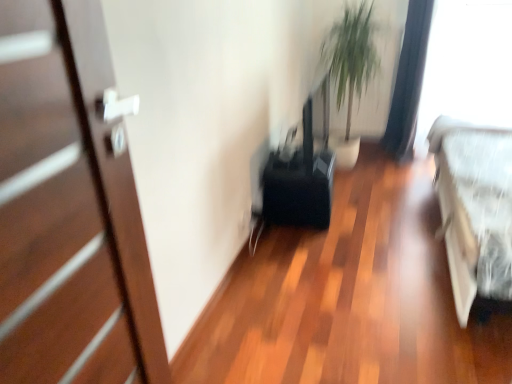
Where is `white fabric bed at right`? white fabric bed at right is located at coordinates (475, 209).

Image resolution: width=512 pixels, height=384 pixels. What do you see at coordinates (408, 81) in the screenshot? I see `black fabric curtain at upper right` at bounding box center [408, 81].

You are a GUI agent. You are given a task and a screenshot of the screen. Output one action in this format:
    pyautogui.click(x=<x>, y=<y>)
    Task: Click on the white fabric bed at right
    
    Given the screenshot: What is the action you would take?
    pyautogui.click(x=475, y=209)

Which point is more distant from viewer, (347, 67) or (418, 95)?

The point (418, 95) is more distant.

Considering the sizes of objects green leafy plant at upper center and black fabric curtain at upper right in the image provided, who is wider, green leafy plant at upper center or black fabric curtain at upper right?

With larger width is black fabric curtain at upper right.

Which object is closer to the camera, green leafy plant at upper center or black fabric curtain at upper right?

Positioned in front is black fabric curtain at upper right.

Between transparent plastic window screen at upper right and white fabric bed at right, which one appears on the left side from the viewer's perspective?

white fabric bed at right is more to the left.

How much distance is there between transparent plastic window screen at upper right and white fabric bed at right?

transparent plastic window screen at upper right and white fabric bed at right are 39.33 inches apart from each other.

Is transparent plastic window screen at upper right wider than white fabric bed at right?

In fact, transparent plastic window screen at upper right might be narrower than white fabric bed at right.

Where is `bed in front of the transparent plastic window screen at upper right`? The width and height of the screenshot is (512, 384). bed in front of the transparent plastic window screen at upper right is located at coordinates (475, 209).

In order to click on door on the left of the transparent plastic window screen at upper right in this screenshot , I will do `click(69, 210)`.

In the scene shown: Considering the relative sizes of matte white door at left and transparent plastic window screen at upper right in the image provided, is matte white door at left shorter than transparent plastic window screen at upper right?

Yes.

Is transparent plastic window screen at upper right located within matte white door at left?

No, transparent plastic window screen at upper right is not surrounded by matte white door at left.

From a real-world perspective, who is located higher, matte white door at left or transparent plastic window screen at upper right?

matte white door at left, from a real-world perspective.

Which of these two, green leafy plant at upper center or white fabric bed at right, stands taller?

With more height is green leafy plant at upper center.

From the image's perspective, does green leafy plant at upper center appear higher than white fabric bed at right?

Yes, from the image's perspective, green leafy plant at upper center is above white fabric bed at right.

Is green leafy plant at upper center in contact with white fabric bed at right?

There is a gap between green leafy plant at upper center and white fabric bed at right.

Can you confirm if green leafy plant at upper center is positioned to the left of white fabric bed at right?

Indeed, green leafy plant at upper center is positioned on the left side of white fabric bed at right.

Is matte white door at left not within green leafy plant at upper center?

Yes.

Is matte white door at left thinner than green leafy plant at upper center?

In fact, matte white door at left might be wider than green leafy plant at upper center.

In the scene shown: Is matte white door at left positioned behind green leafy plant at upper center?

No, it is not.

Does white fabric bed at right have a greater width compared to green leafy plant at upper center?

Yes.

Considering the relative sizes of white fabric bed at right and green leafy plant at upper center in the image provided, is white fabric bed at right shorter than green leafy plant at upper center?

Indeed, white fabric bed at right has a lesser height compared to green leafy plant at upper center.

From the image's perspective, between white fabric bed at right and green leafy plant at upper center, who is located below?

white fabric bed at right is shown below in the image.

From a real-world perspective, does white fabric bed at right stand above green leafy plant at upper center?

No, from a real-world perspective, white fabric bed at right is not above green leafy plant at upper center.

Is black fabric curtain at upper right looking in the opposite direction of transparent plastic window screen at upper right?

That's not correct — black fabric curtain at upper right is not looking away from transparent plastic window screen at upper right.

From their relative heights in the image, would you say black fabric curtain at upper right is taller or shorter than transparent plastic window screen at upper right?

In the image, black fabric curtain at upper right appears to be taller than transparent plastic window screen at upper right.

Locate an element on the screen. This screenshot has height=384, width=512. curtain above the transparent plastic window screen at upper right (from the image's perspective) is located at coordinates (408, 81).

From a real-world perspective, is black fabric curtain at upper right located beneath transparent plastic window screen at upper right?

No, from a real-world perspective, black fabric curtain at upper right is not under transparent plastic window screen at upper right.

Identify the location of plant that appears behind the black fabric curtain at upper right. (357, 70).

Locate an element on the screen. bed on the left of transparent plastic window screen at upper right is located at coordinates (475, 209).

Which object lies nearer to the anchor point matte white door at left, transparent plastic window screen at upper right or black fabric curtain at upper right?

black fabric curtain at upper right lies closer to matte white door at left than the other object.

When comparing their distances from transparent plastic window screen at upper right, does green leafy plant at upper center or matte white door at left seem further?

Based on the image, matte white door at left appears to be further to transparent plastic window screen at upper right.

From the picture: When comparing their distances from black fabric curtain at upper right, does transparent plastic window screen at upper right or matte white door at left seem further?

matte white door at left is positioned further to the anchor black fabric curtain at upper right.

Looking at the image, which one is located closer to transparent plastic window screen at upper right, black fabric curtain at upper right or white fabric bed at right?

black fabric curtain at upper right.

From the image, which object appears to be nearer to green leafy plant at upper center, black fabric curtain at upper right or white fabric bed at right?

black fabric curtain at upper right lies closer to green leafy plant at upper center than the other object.

Looking at this image, looking at the image, which one is located closer to white fabric bed at right, transparent plastic window screen at upper right or matte white door at left?

Based on the image, transparent plastic window screen at upper right appears to be nearer to white fabric bed at right.

Considering their positions, is white fabric bed at right positioned further to black fabric curtain at upper right than transparent plastic window screen at upper right?

Among the two, white fabric bed at right is located further to black fabric curtain at upper right.

Looking at the image, which one is located closer to matte white door at left, black fabric curtain at upper right or green leafy plant at upper center?

green leafy plant at upper center is closer to matte white door at left.

Where is `bed between matte white door at left and green leafy plant at upper center in the front-back direction`? Image resolution: width=512 pixels, height=384 pixels. bed between matte white door at left and green leafy plant at upper center in the front-back direction is located at coordinates (475, 209).

At what (x,y) coordinates should I click in order to perform the action: click on window screen positioned between white fabric bed at right and green leafy plant at upper center from near to far. Please return your answer as a coordinate pair (x, y). Looking at the image, I should click on (467, 66).

The height and width of the screenshot is (384, 512). In order to click on window screen between matte white door at left and green leafy plant at upper center in the front-back direction in this screenshot , I will do `click(467, 66)`.

You are a GUI agent. You are given a task and a screenshot of the screen. Output one action in this format:
    pyautogui.click(x=<x>, y=<y>)
    Task: Click on the curtain located between matte white door at left and green leafy plant at upper center in the depth direction
    The height and width of the screenshot is (384, 512).
    Given the screenshot: What is the action you would take?
    pyautogui.click(x=408, y=81)